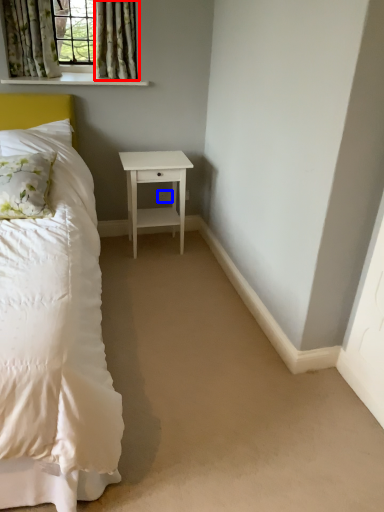
Question: Which object appears farthest to the camera in this image, curtain (highlighted by a red box) or electric outlet (highlighted by a blue box)?

Choices:
 (A) curtain
 (B) electric outlet

Answer: (B)